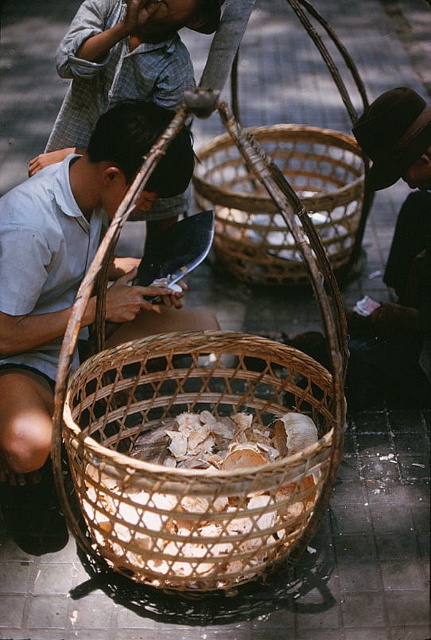
You are standing in the same position as the man in the image. If you want to reach for the matte wicker basket at center and the light blue shirt at lower left, which item is closer to your right hand?

The light blue shirt at lower left is to the right of the matte wicker basket at center, so the light blue shirt at lower left would be closer to your right hand.

You are a delivery person who needs to place a small package in the matte wicker basket at center. The package is 25 inches long. Can you fit it inside the basket without overlapping the white textured shells at center?

The distance between the matte wicker basket at center and white textured shells at center is 24.84 inches. Since the package is 25 inches long, it would overlap the shells by approximately 0.16 inches.